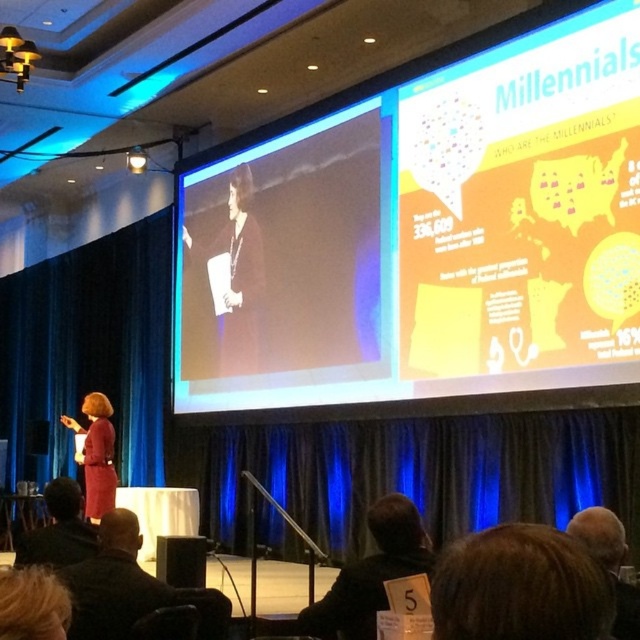
Question: From the image, what is the correct spatial relationship of matte black screen at upper center in relation to matte red dress at center?

Choices:
 (A) above
 (B) below

Answer: (A)

Question: Among these points, which one is farthest from the camera?

Choices:
 (A) (243, 316)
 (B) (305, 612)

Answer: (A)

Question: Among these objects, which one is nearest to the camera?

Choices:
 (A) brown hair at upper center
 (B) matte black speaker at lower center

Answer: (A)

Question: Where is brown hair at upper center located in relation to matte black speaker at lower center in the image?

Choices:
 (A) left
 (B) right

Answer: (B)

Question: Which point is closer to the camera?

Choices:
 (A) (516, 621)
 (B) (240, 259)

Answer: (A)

Question: Does blue velvet curtain at center appear over matte black dress at center?

Choices:
 (A) yes
 (B) no

Answer: (B)